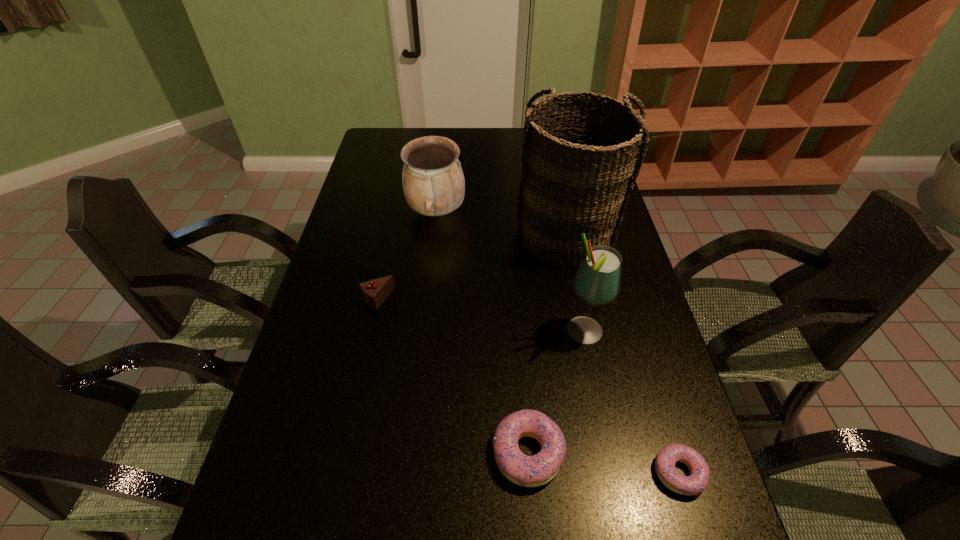
You are a GUI agent. You are given a task and a screenshot of the screen. Output one action in this format:
    pyautogui.click(x=<x>, y=<y>)
    Task: Click on the second shortest object
    This screenshot has height=540, width=960.
    Given the screenshot: What is the action you would take?
    pyautogui.click(x=528, y=471)

At what (x,y) coordinates should I click in order to perform the action: click on the taller doughnut. Please return your answer as a coordinate pair (x, y). Looking at the image, I should click on (528, 471).

Locate an element on the screen. The height and width of the screenshot is (540, 960). the shorter doughnut is located at coordinates (697, 481).

Where is `the right doughnut`? The image size is (960, 540). the right doughnut is located at coordinates (697, 481).

Where is `urn`? Image resolution: width=960 pixels, height=540 pixels. urn is located at coordinates (433, 181).

This screenshot has width=960, height=540. In order to click on the tallest object in this screenshot , I will do `click(579, 163)`.

You are a GUI agent. You are given a task and a screenshot of the screen. Output one action in this format:
    pyautogui.click(x=<x>, y=<y>)
    Task: Click on the alcohol
    The height and width of the screenshot is (540, 960).
    Given the screenshot: What is the action you would take?
    pyautogui.click(x=597, y=282)

Locate an element on the screen. Image resolution: width=960 pixels, height=540 pixels. the fifth shortest object is located at coordinates (597, 282).

This screenshot has height=540, width=960. I want to click on chocolate cake, so click(374, 292).

Image resolution: width=960 pixels, height=540 pixels. I want to click on free space located on the right of the taller doughnut, so pyautogui.click(x=670, y=452).